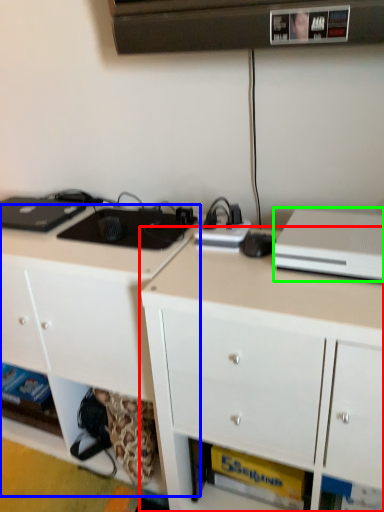
Question: Based on their relative distances, which object is farther from cabinetry (highlighted by a red box)? Choose from cabinetry (highlighted by a blue box) and desktop computer (highlighted by a green box).

Choices:
 (A) cabinetry
 (B) desktop computer

Answer: (A)